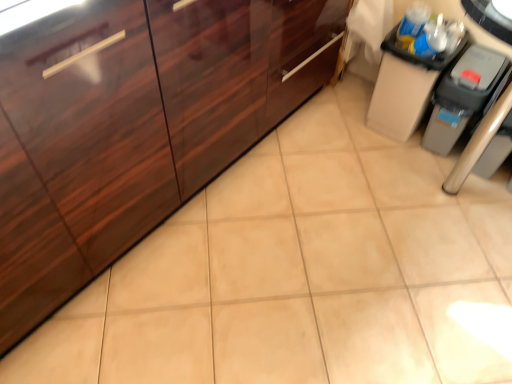
Locate an element on the screen. vacant region to the left of gray plastic trash can at right is located at coordinates (392, 153).